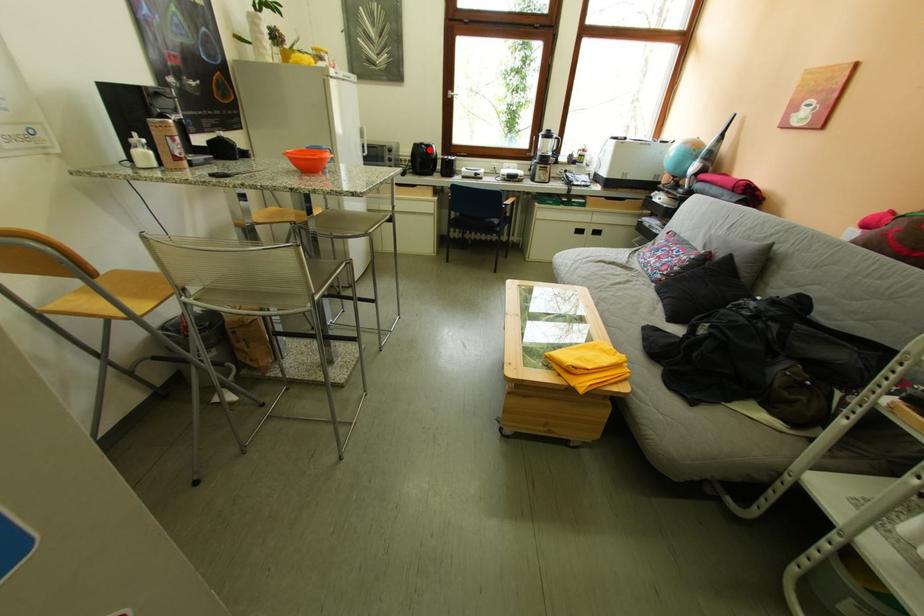
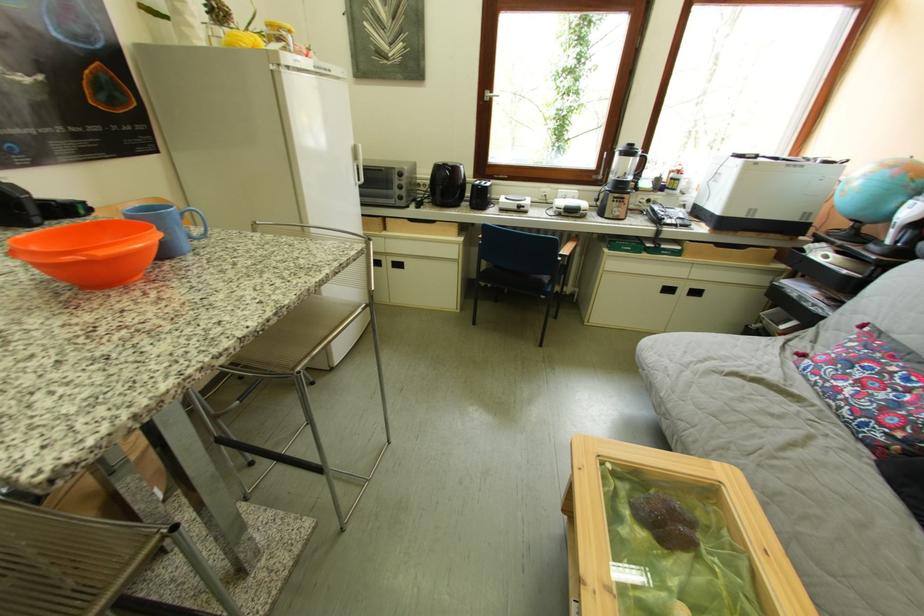
Question: I am providing you with two images of the same scene from different viewpoints. In image1, a red point is highlighted. Considering the same 3D point in image2, which of the following is correct?

Choices:
 (A) It is closer
 (B) It is farther

Answer: (B)